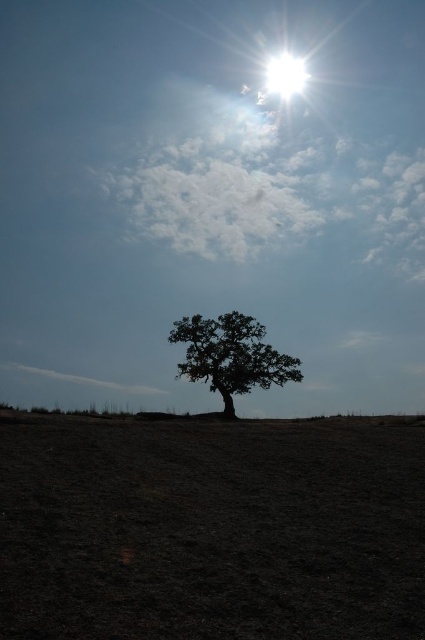
You are standing at the point with coordinates [231,355] in the image. What is the closest object to you?

The silhouette leafy tree at center is located at point [231,355], so you are standing right at the base of the tree.

You are an astronomer observing the sky through a telescope. You notice the silhouette leafy tree at center and the bright white sun at upper center. Which object is closer to your telescope? Please explain your reasoning based on the scene.

The silhouette leafy tree at center is closer to your telescope because it is blocking the view of the bright white sun at upper center, meaning it is positioned in front of the sun in the scene.